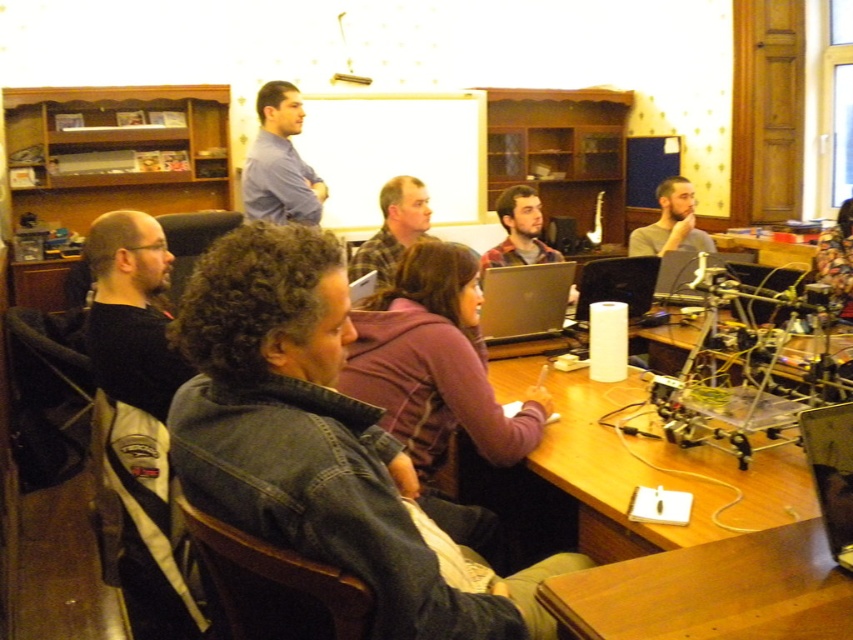
Does silver metallic laptop at center have a greater width compared to smooth gray shirt at center?

In fact, silver metallic laptop at center might be narrower than smooth gray shirt at center.

Which is more to the left, silver metallic laptop at center or smooth gray shirt at center?

Positioned to the left is silver metallic laptop at center.

Locate an element on the screen. The width and height of the screenshot is (853, 640). silver metallic laptop at center is located at coordinates (524, 300).

Is silver metallic laptop at center positioned behind black plastic laptop at center?

No, silver metallic laptop at center is in front of black plastic laptop at center.

Does point (527, 289) lie in front of point (604, 291)?

Yes, point (527, 289) is closer to viewer.

Who is more forward, (x=496, y=326) or (x=576, y=316)?

Positioned in front is point (x=496, y=326).

This screenshot has width=853, height=640. In order to click on silver metallic laptop at center in this screenshot , I will do `click(524, 300)`.

Who is positioned more to the left, denim jacket at lower left or metallic silver laptop at center?

denim jacket at lower left is more to the left.

Does denim jacket at lower left have a larger size compared to metallic silver laptop at center?

Correct, denim jacket at lower left is larger in size than metallic silver laptop at center.

Is point (546, 627) positioned in front of point (834, 484)?

No, it is not.

Identify the location of denim jacket at lower left. This screenshot has width=853, height=640. (315, 438).